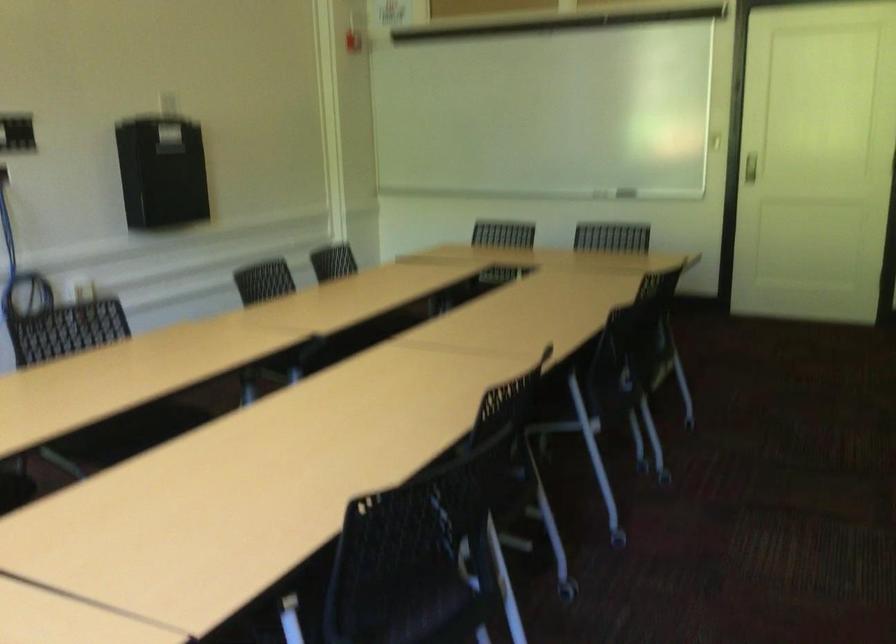
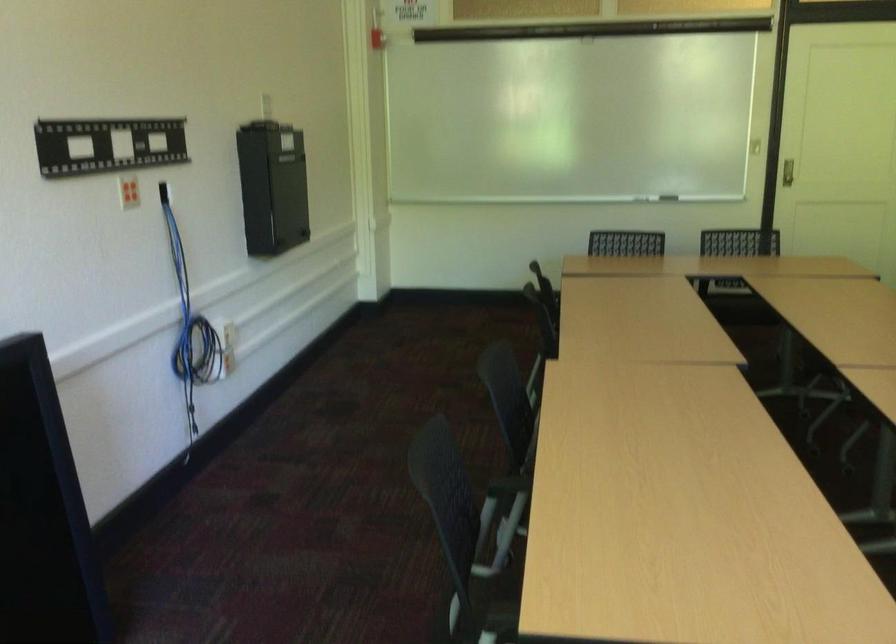
Locate, in the second image, the point that corresponds to pixel 616 205 in the first image.

(668, 198)